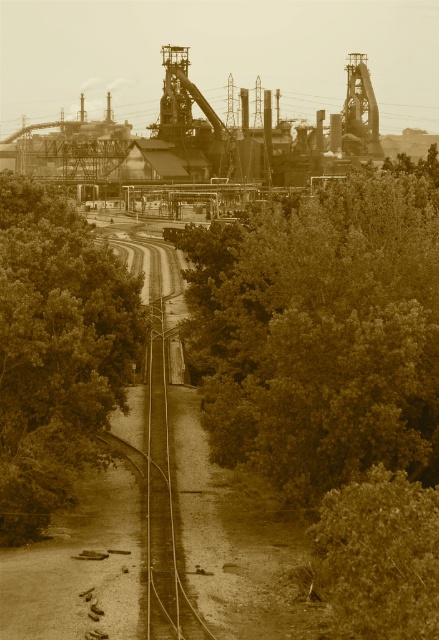
You are a landscape architect designing a walking path between the green leafy tree at center and the green leafy tree at left. Which tree should you consider for a wider pathway design?

The green leafy tree at center might be wider than the green leafy tree at left, so the pathway should be designed wider near the green leafy tree at center to accommodate its size.

You are a photographer standing at the edge of the industrial area and want to capture a photo that includes both the green leafy tree at center and the green leafy tree at left. Which tree should you position closer to the front of the photo to ensure both are visible?

The green leafy tree at center should be positioned closer to the front of the photo because it is positioned over the green leafy tree at left, meaning it is closer to the photographer.

You are standing at the point marked by the coordinates point (321, 332) in the image. What is the nearest object to you?

The nearest object to you is the green leafy tree at center, as the point (321, 332) represents its location.